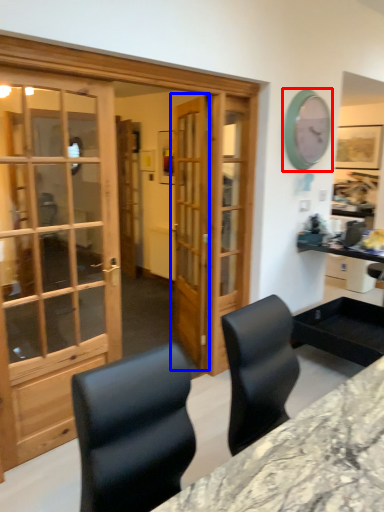
Question: Which of the following is the closest to the observer, clock (highlighted by a red box) or door (highlighted by a blue box)?

Choices:
 (A) clock
 (B) door

Answer: (B)